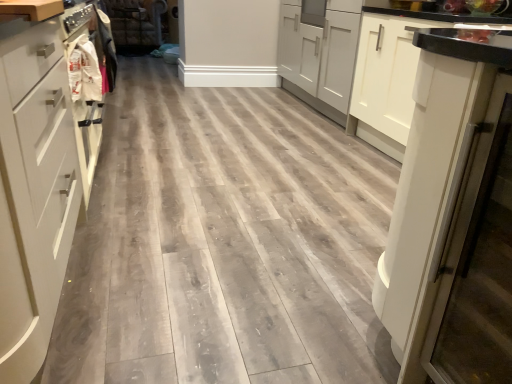
Question: From the image's perspective, is white fabric bag at left on white matte cabinet at right, which is the first cabinetry from back to front?

Choices:
 (A) no
 (B) yes

Answer: (A)

Question: From the image's perspective, is white fabric bag at left under white matte cabinet at right, the second cabinetry viewed from the left?

Choices:
 (A) no
 (B) yes

Answer: (B)

Question: Is white fabric bag at left completely or partially outside of white matte cabinet at right, which is the first cabinetry from back to front?

Choices:
 (A) no
 (B) yes

Answer: (B)

Question: Considering the relative sizes of white fabric bag at left and white matte cabinet at right, which is the first cabinetry from back to front, in the image provided, is white fabric bag at left thinner than white matte cabinet at right, which is the first cabinetry from back to front,?

Choices:
 (A) yes
 (B) no

Answer: (A)

Question: Is white fabric bag at left looking in the opposite direction of white matte cabinet at right, which is the first cabinetry from back to front?

Choices:
 (A) yes
 (B) no

Answer: (B)

Question: Does white fabric bag at left appear on the right side of white matte cabinet at right, which is the first cabinetry from back to front?

Choices:
 (A) no
 (B) yes

Answer: (A)

Question: Is white matte drawer at left positioned behind white glossy refrigerator at right?

Choices:
 (A) no
 (B) yes

Answer: (B)

Question: Is white matte drawer at left bigger than white glossy refrigerator at right?

Choices:
 (A) no
 (B) yes

Answer: (B)

Question: Does white matte drawer at left lie in front of white glossy refrigerator at right?

Choices:
 (A) no
 (B) yes

Answer: (A)

Question: From a real-world perspective, does white matte drawer at left stand above white glossy refrigerator at right?

Choices:
 (A) no
 (B) yes

Answer: (A)

Question: Can you confirm if white matte drawer at left is smaller than white glossy refrigerator at right?

Choices:
 (A) yes
 (B) no

Answer: (B)

Question: Is white glossy refrigerator at right surrounded by white matte drawer at left?

Choices:
 (A) yes
 (B) no

Answer: (B)

Question: Is the surface of faux leather couch at upper center in direct contact with white fabric bag at left?

Choices:
 (A) yes
 (B) no

Answer: (B)